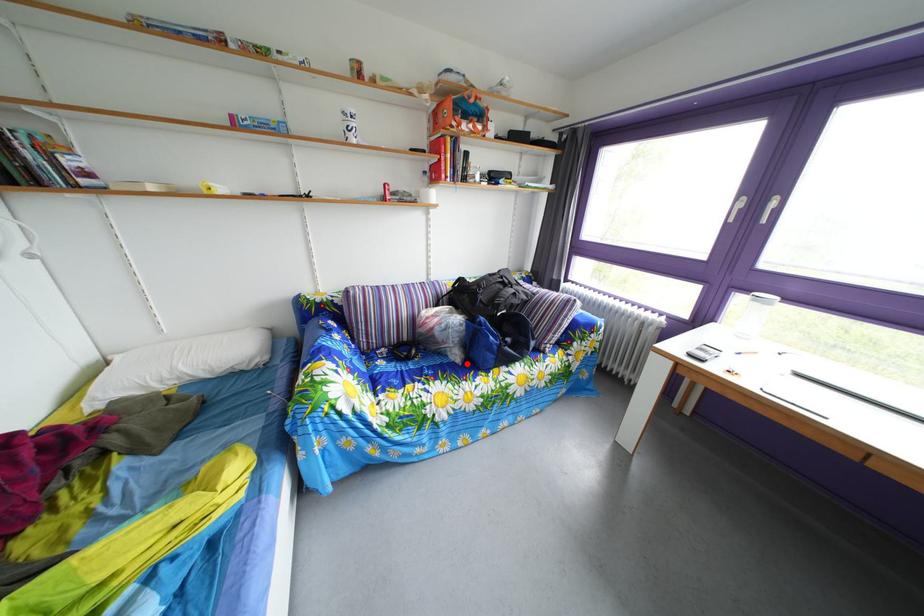
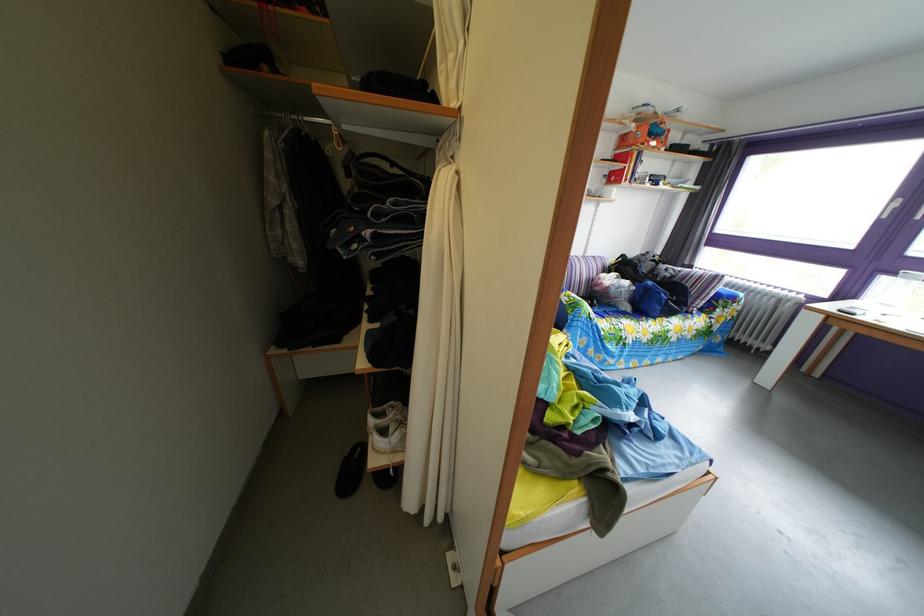
Question: I am providing you with two images of the same scene from different viewpoints. Given a red point in image1, look at the same physical point in image2. Is it:

Choices:
 (A) Closer to the viewpoint
 (B) Farther from the viewpoint

Answer: (A)